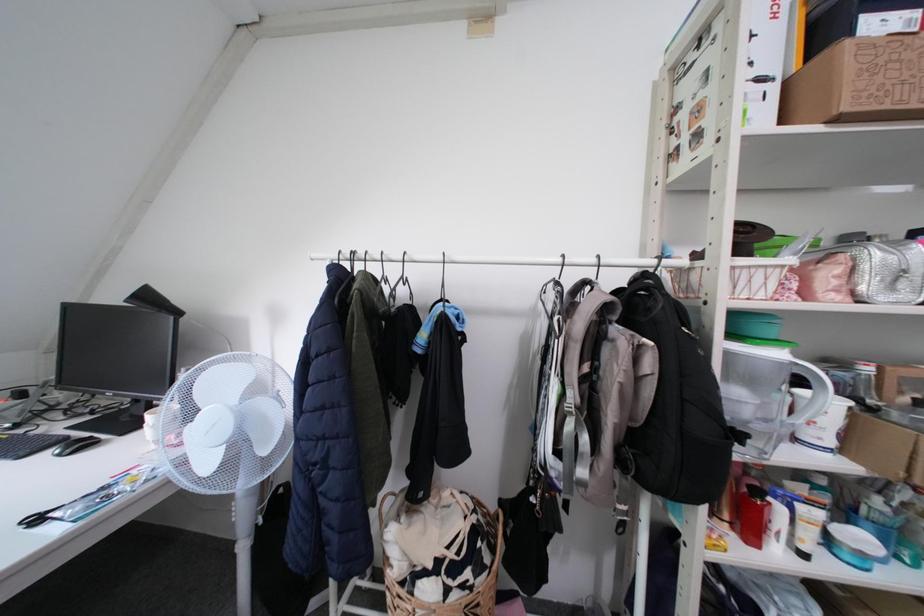
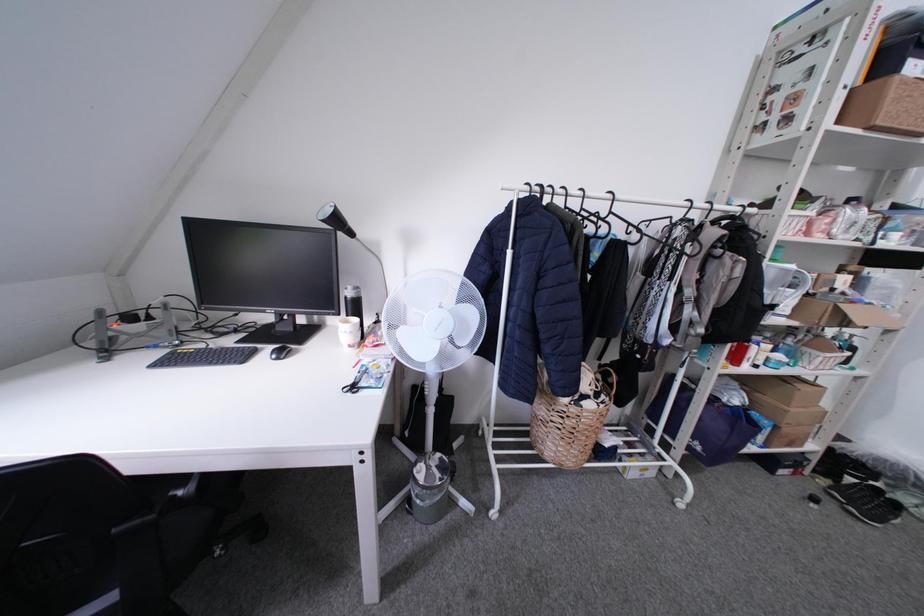
Question: Based on the continuous images, in which direction is the camera rotating? Reply with the corresponding letter.

Choices:
 (A) Left
 (B) Right
 (C) Up
 (D) Down

Answer: (D)